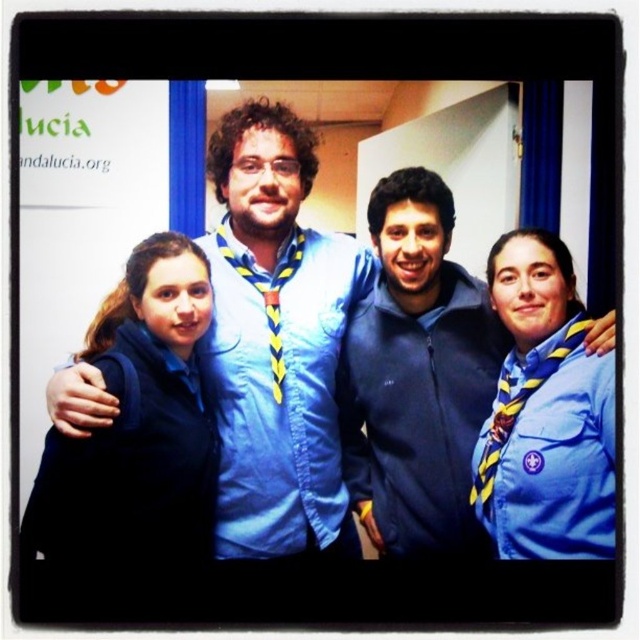
You are organizing a group photo and need to ensure that the blue fabric uniform at right is visible. Since the blue denim shirt at center is in front of it, how can you adjust their positions to make sure both are visible?

Move the blue denim shirt at center to the side so the blue fabric uniform at right can be seen behind it.

You are standing in front of the group photo. You need to determine which of the two items, the matte blue uniform at left or the navy blue fleece jacket at center, is positioned closer to you. Based on the scene description, which one is nearer?

The matte blue uniform at left is closer to the viewer than the navy blue fleece jacket at center according to the description.

You are a photographer trying to capture a group photo. You notice two items in the scene that are both blue and at the center of the image. The items are the blue fabric shirt at center and the navy blue fleece jacket at center. The camera you are using has a minimum focus distance of 0.5 inches. Can you focus on both items simultaneously?

The distance between the blue fabric shirt at center and navy blue fleece jacket at center is 0.70 inches. Since the camera has a minimum focus distance of 0.5 inches, which is less than the 0.70 inches separating the two items, the camera can focus on both items simultaneously.